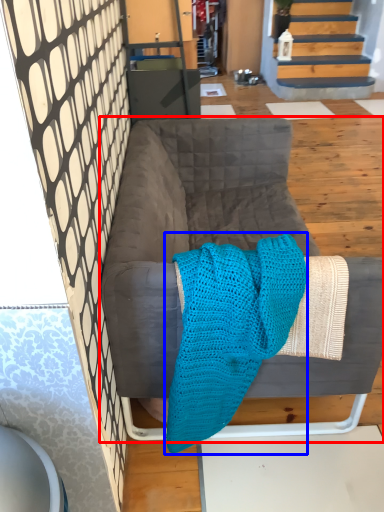
Question: Which object appears farthest to the camera in this image, furniture (highlighted by a red box) or cloth (highlighted by a blue box)?

Choices:
 (A) furniture
 (B) cloth

Answer: (A)